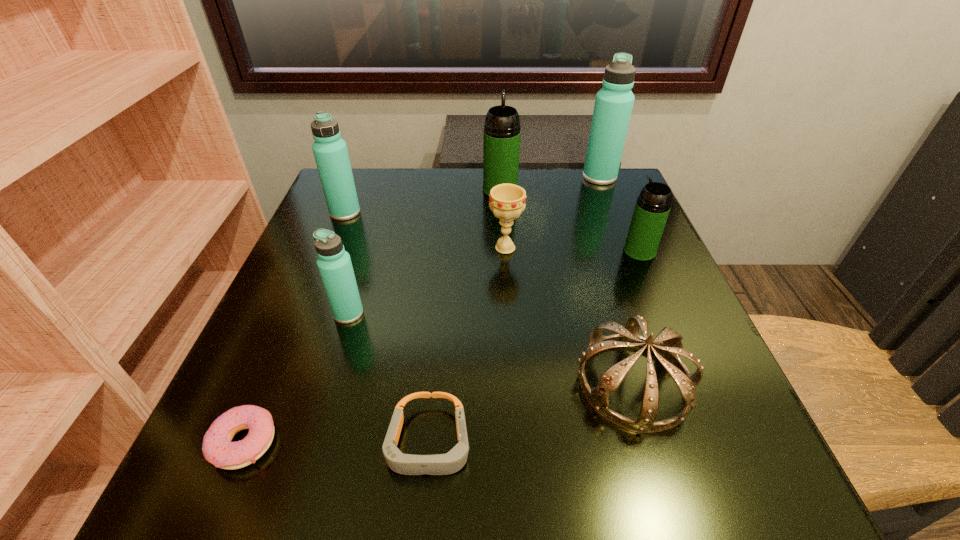
Identify the location of the biggest aqua thermos bottle. The image size is (960, 540). (613, 106).

In order to click on the tallest thermos bottle in this screenshot , I will do `click(613, 106)`.

At what (x,y) coordinates should I click in order to perform the action: click on the bigger green thermos bottle. Please return your answer as a coordinate pair (x, y). Looking at the image, I should click on (501, 144).

Where is `the left green thermos bottle`? the left green thermos bottle is located at coordinates [x=501, y=144].

At what (x,y) coordinates should I click in order to perform the action: click on the seventh nearest object. Please return your answer as a coordinate pair (x, y). Image resolution: width=960 pixels, height=540 pixels. Looking at the image, I should click on (330, 151).

The height and width of the screenshot is (540, 960). Identify the location of the third nearest thermos bottle. (330, 151).

Locate an element on the screen. The width and height of the screenshot is (960, 540). the nearest aqua thermos bottle is located at coordinates (334, 263).

Identify the location of the second aqua thermos bottle from right to left. The width and height of the screenshot is (960, 540). (334, 263).

Find the location of a particular element. The image size is (960, 540). the smaller green thermos bottle is located at coordinates (652, 208).

At what (x,y) coordinates should I click in order to perform the action: click on the nearer green thermos bottle. Please return your answer as a coordinate pair (x, y). The image size is (960, 540). Looking at the image, I should click on (652, 208).